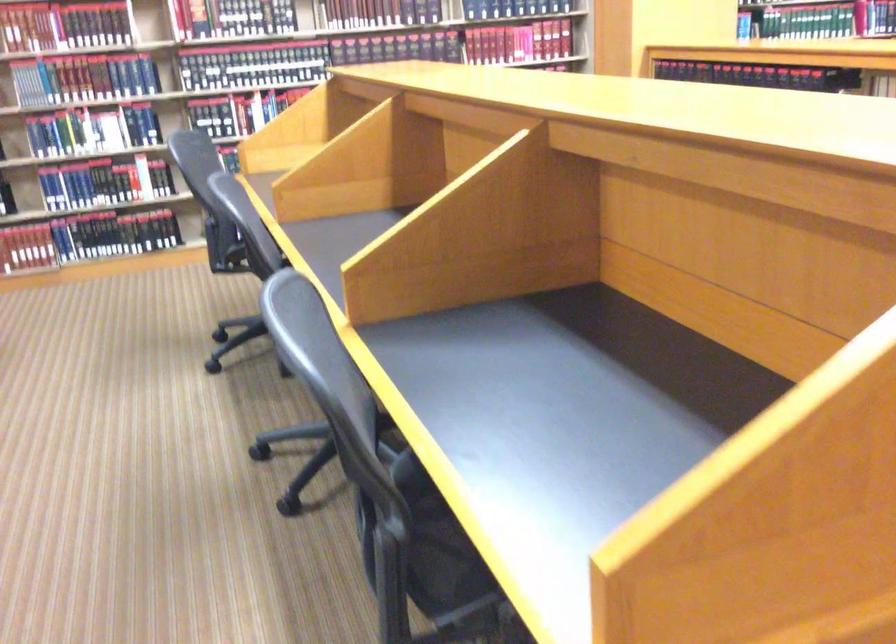
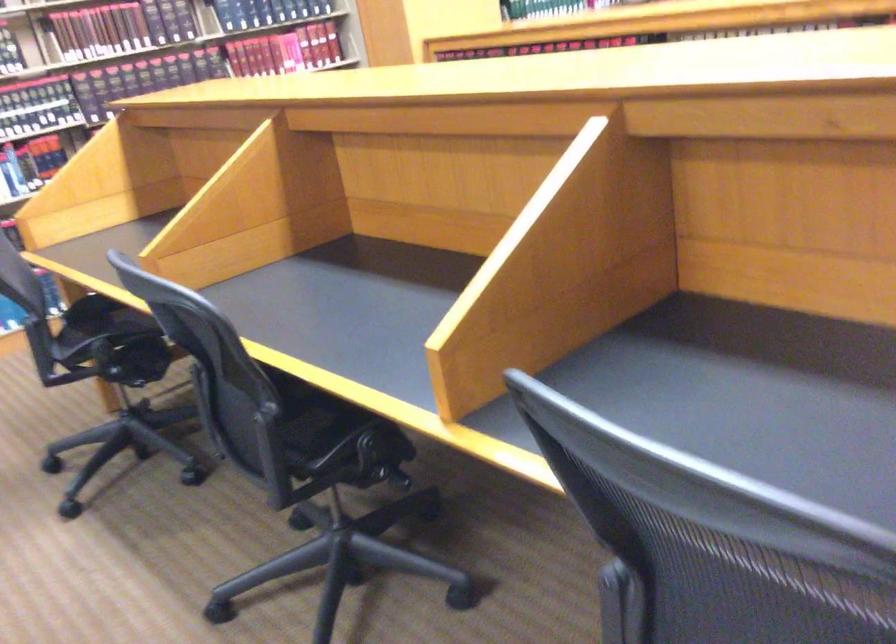
Question: How did the camera likely rotate?

Choices:
 (A) Left
 (B) Right
 (C) Up
 (D) Down

Answer: (B)